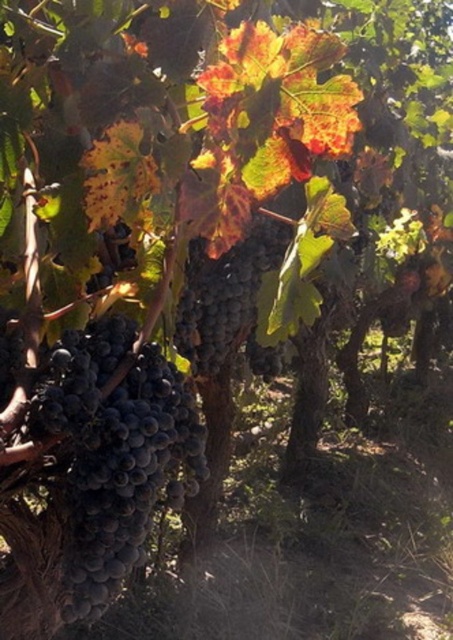
Question: Can you confirm if shiny dark purple grapes at center-left is positioned to the right of shiny dark purple grapes at center?

Choices:
 (A) yes
 (B) no

Answer: (B)

Question: Which object appears farthest from the camera in this image?

Choices:
 (A) shiny dark purple grapes at center
 (B) shiny dark purple grapes at center-left

Answer: (A)

Question: Does shiny dark purple grapes at center-left appear on the left side of shiny dark purple grapes at center?

Choices:
 (A) yes
 (B) no

Answer: (A)

Question: Does shiny dark purple grapes at center-left have a lesser width compared to shiny dark purple grapes at center?

Choices:
 (A) no
 (B) yes

Answer: (A)

Question: Which object is closer to the camera taking this photo?

Choices:
 (A) shiny dark purple grapes at center-left
 (B) shiny dark purple grapes at center

Answer: (A)

Question: Which of the following is the closest to the observer?

Choices:
 (A) (289, 230)
 (B) (167, 449)

Answer: (B)